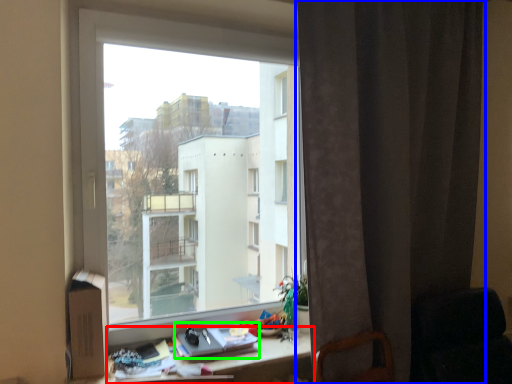
Question: Which object is positioned closest to desk (highlighted by a red box)? Select from curtain (highlighted by a blue box) and book (highlighted by a green box).

Choices:
 (A) curtain
 (B) book

Answer: (B)